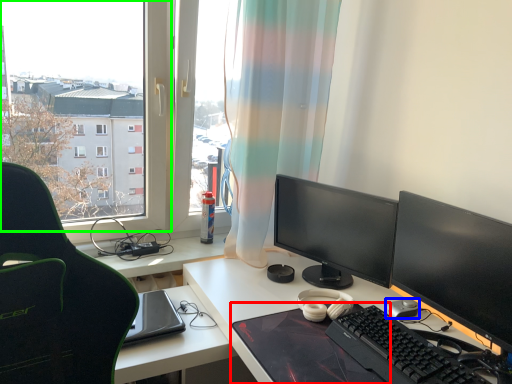
Question: Considering the real-world distances, which object is farthest from mousepad (highlighted by a red box)? mouse (highlighted by a blue box) or window (highlighted by a green box)?

Choices:
 (A) mouse
 (B) window

Answer: (B)